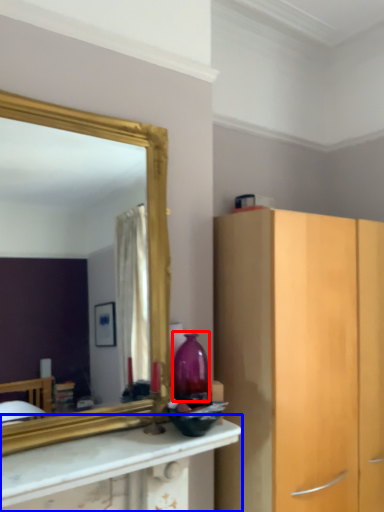
Question: Which of the following is the farthest to the observer, vase (highlighted by a red box) or countertop (highlighted by a blue box)?

Choices:
 (A) vase
 (B) countertop

Answer: (A)